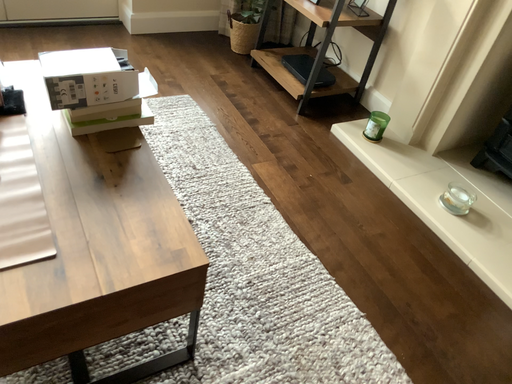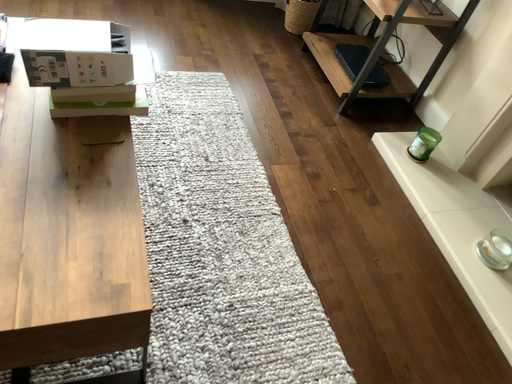
Question: How did the camera likely rotate when shooting the video?

Choices:
 (A) rotated right
 (B) rotated left

Answer: (B)